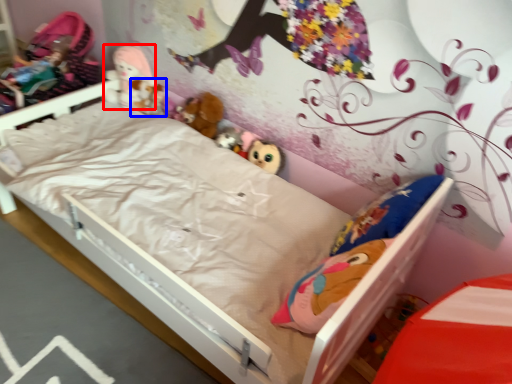
Question: Among these objects, which one is nearest to the camera, doll (highlighted by a red box) or toy (highlighted by a blue box)?

Choices:
 (A) doll
 (B) toy

Answer: (A)